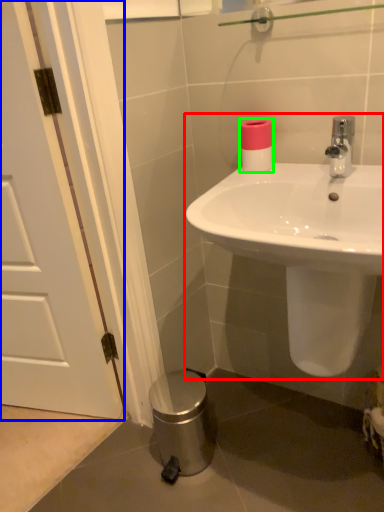
Question: Considering the real-world distances, which object is closest to sink (highlighted by a red box)? door (highlighted by a blue box) or toilet paper (highlighted by a green box).

Choices:
 (A) door
 (B) toilet paper

Answer: (B)